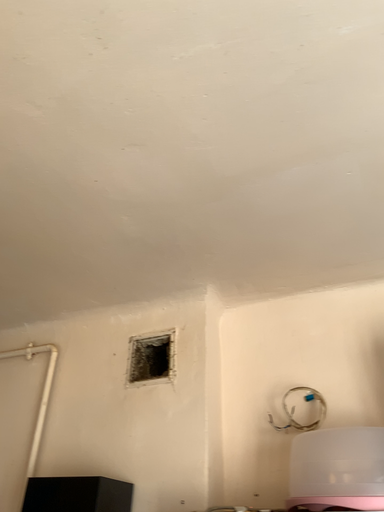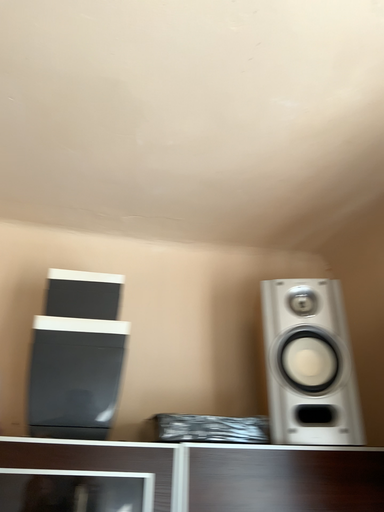
Question: How did the camera likely rotate when shooting the video?

Choices:
 (A) rotated downward
 (B) rotated upward

Answer: (A)